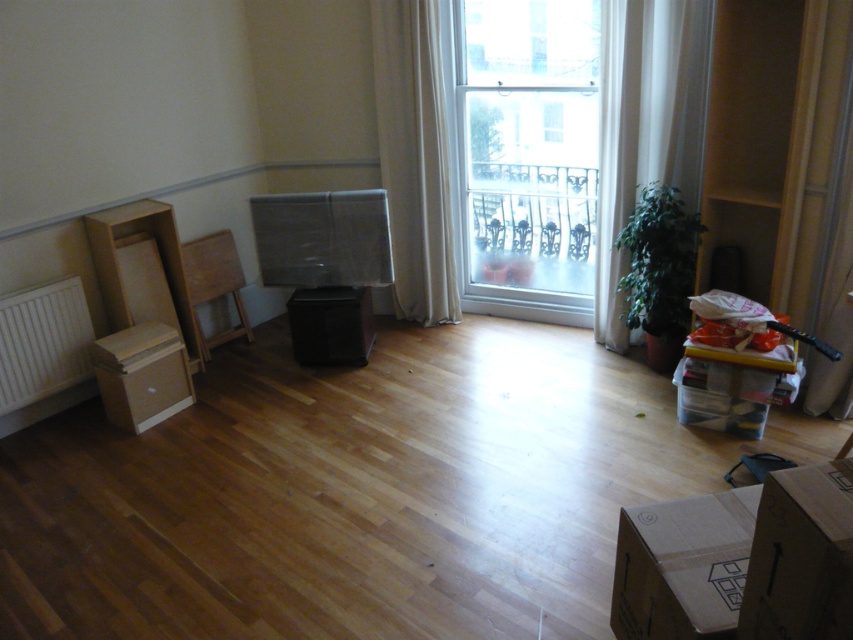
Does clear glass window at center come behind green fabric curtain at right?

That is True.

What do you see at coordinates (526, 154) in the screenshot? This screenshot has width=853, height=640. I see `clear glass window at center` at bounding box center [526, 154].

Is point (564, 168) farther from viewer compared to point (850, 12)?

Yes, it is behind point (850, 12).

At what (x,y) coordinates should I click in order to perform the action: click on clear glass window at center. Please return your answer as a coordinate pair (x, y). Looking at the image, I should click on (526, 154).

Can you confirm if green fabric curtain at right is shorter than brown cardboard box at lower left?

In fact, green fabric curtain at right may be taller than brown cardboard box at lower left.

Image resolution: width=853 pixels, height=640 pixels. Identify the location of green fabric curtain at right. (820, 204).

Which is behind, point (825, 220) or point (135, 349)?

The point (135, 349) is more distant.

The width and height of the screenshot is (853, 640). Find the location of `green fabric curtain at right`. green fabric curtain at right is located at coordinates (820, 204).

Is white fabric curtain at upper right thinner than brown cardboard box at lower right?

No, white fabric curtain at upper right is not thinner than brown cardboard box at lower right.

Is white fabric curtain at upper right smaller than brown cardboard box at lower right?

No, white fabric curtain at upper right is not smaller than brown cardboard box at lower right.

This screenshot has height=640, width=853. What do you see at coordinates (415, 157) in the screenshot?
I see `white fabric curtain at upper right` at bounding box center [415, 157].

You are a GUI agent. You are given a task and a screenshot of the screen. Output one action in this format:
    pyautogui.click(x=<x>, y=<y>)
    Task: Click on the white fabric curtain at upper right
    
    Given the screenshot: What is the action you would take?
    pyautogui.click(x=415, y=157)